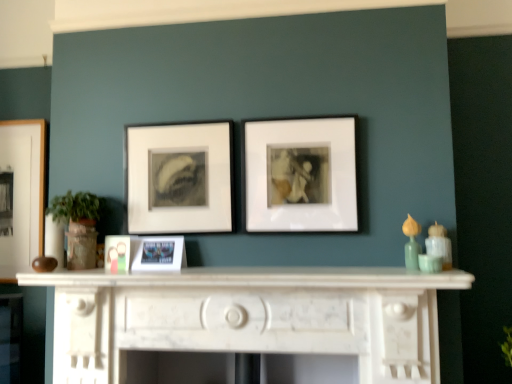
Where is `free space in front of matte plastic photo frame at center, marked as the third picture frame in a front-to-back arrangement`? This screenshot has width=512, height=384. free space in front of matte plastic photo frame at center, marked as the third picture frame in a front-to-back arrangement is located at coordinates (104, 274).